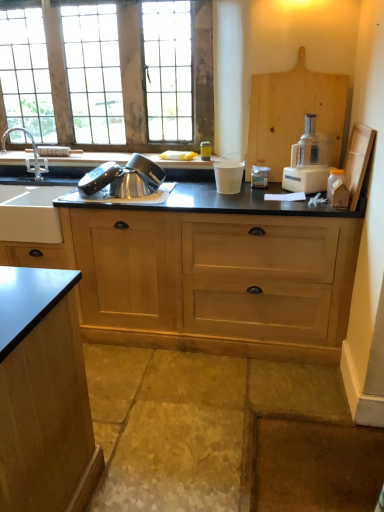
Question: Is wooden window at upper left positioned before silver metallic faucet at left?

Choices:
 (A) yes
 (B) no

Answer: (B)

Question: Is wooden window at upper left looking in the opposite direction of silver metallic faucet at left?

Choices:
 (A) no
 (B) yes

Answer: (A)

Question: Can you confirm if wooden window at upper left is shorter than silver metallic faucet at left?

Choices:
 (A) yes
 (B) no

Answer: (B)

Question: Would you say wooden window at upper left contains silver metallic faucet at left?

Choices:
 (A) yes
 (B) no

Answer: (B)

Question: Is wooden window at upper left wider than silver metallic faucet at left?

Choices:
 (A) yes
 (B) no

Answer: (B)

Question: From the image's perspective, is wooden window at upper left beneath silver metallic faucet at left?

Choices:
 (A) yes
 (B) no

Answer: (B)

Question: Can you confirm if silver metallic faucet at left is positioned to the right of metallic silver colander at sink?

Choices:
 (A) no
 (B) yes

Answer: (A)

Question: Is silver metallic faucet at left far away from metallic silver colander at sink?

Choices:
 (A) no
 (B) yes

Answer: (B)

Question: From a real-world perspective, is silver metallic faucet at left under metallic silver colander at sink?

Choices:
 (A) no
 (B) yes

Answer: (A)

Question: Is silver metallic faucet at left aimed at metallic silver colander at sink?

Choices:
 (A) no
 (B) yes

Answer: (A)

Question: Considering the relative sizes of silver metallic faucet at left and metallic silver colander at sink in the image provided, is silver metallic faucet at left wider than metallic silver colander at sink?

Choices:
 (A) yes
 (B) no

Answer: (B)

Question: Does silver metallic faucet at left have a greater height compared to metallic silver colander at sink?

Choices:
 (A) yes
 (B) no

Answer: (A)

Question: Is metallic silver colander at sink looking in the opposite direction of black matte countertop at center?

Choices:
 (A) no
 (B) yes

Answer: (A)